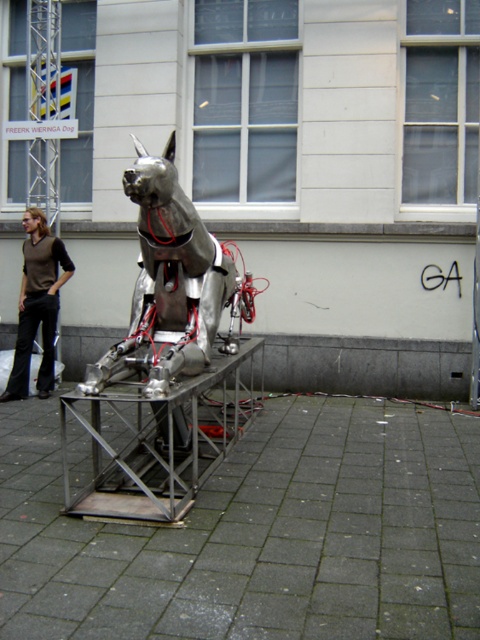
Question: Observing the image, what is the correct spatial positioning of shiny metallic dog at center in reference to brownmaterial/texturevest at left?

Choices:
 (A) right
 (B) left

Answer: (A)

Question: Which object is closer to the camera taking this photo?

Choices:
 (A) shiny metallic dog at center
 (B) brownmaterial/texturevest at left

Answer: (A)

Question: Which of the following is the farthest from the observer?

Choices:
 (A) brownmaterial/texturevest at left
 (B) shiny metallic dog at center

Answer: (A)

Question: Does shiny metallic dog at center appear under brownmaterial/texturevest at left?

Choices:
 (A) yes
 (B) no

Answer: (A)

Question: Does shiny metallic dog at center appear on the left side of brownmaterial/texturevest at left?

Choices:
 (A) no
 (B) yes

Answer: (A)

Question: Which object is closer to the camera taking this photo?

Choices:
 (A) brownmaterial/texturevest at left
 (B) shiny metallic dog at center

Answer: (B)